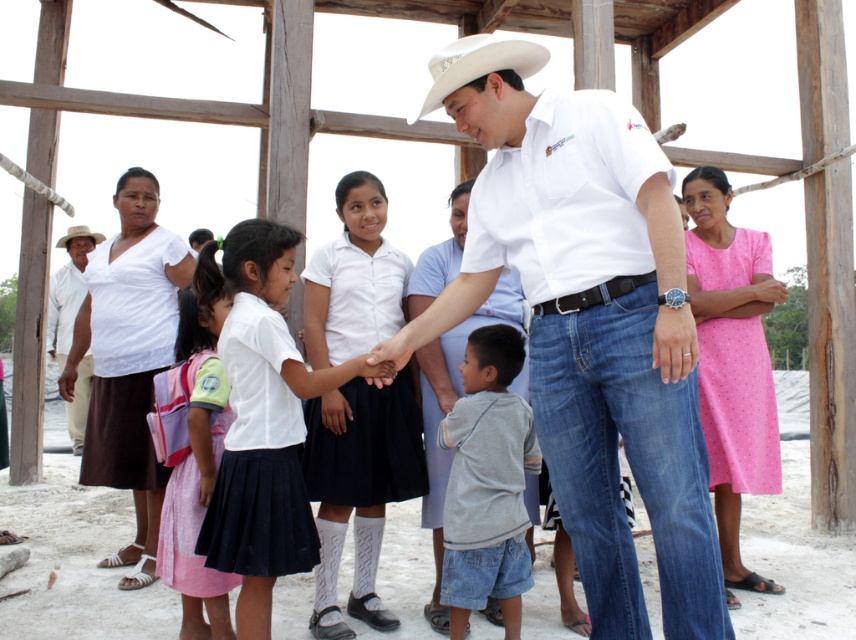
You are a photographer at the event and want to ensure both the white matte skirt at center and the gray cotton shirt at center are clearly visible in your photo. Which one should you focus on to capture the most detail?

The white matte skirt at center is larger in size than the gray cotton shirt at center, so focusing on the white matte skirt at center will allow you to capture more detail due to its larger size.

What is the exact coordinate of the white matte skirt at center?

The white matte skirt at center is located at point (265, 428).

Based on the scene description, can you determine the spatial relationship between the white matte skirt at center and the white felt cowboy hat at upper left?

The white matte skirt at center is positioned under the white felt cowboy hat at upper left.